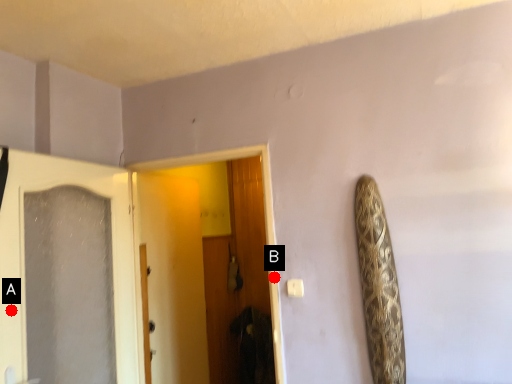
Question: Two points are circled on the image, labeled by A and B beside each circle. Which point is closer to the camera?

Choices:
 (A) A is closer
 (B) B is closer

Answer: (A)